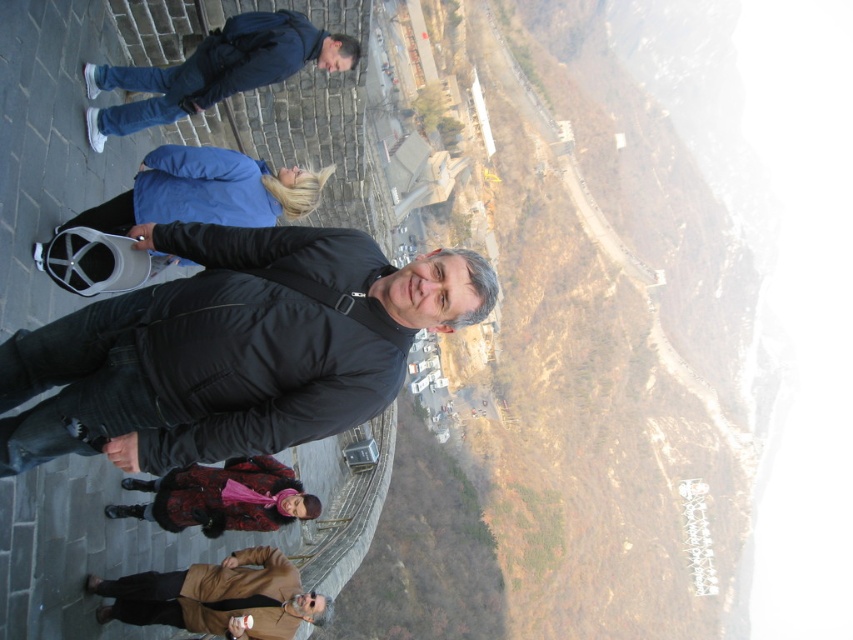
Question: Observing the image, what is the correct spatial positioning of black matte jacket at center in reference to velvet-like red coat at center?

Choices:
 (A) right
 (B) left

Answer: (A)

Question: Which point appears farthest from the camera in this image?

Choices:
 (A) (119, 618)
 (B) (155, 81)
 (C) (236, 484)

Answer: (C)

Question: Is matte blue jacket at center smaller than brown leather jacket at lower center?

Choices:
 (A) no
 (B) yes

Answer: (A)

Question: Which object appears closest to the camera in this image?

Choices:
 (A) black matte jacket at center
 (B) matte blue jacket at center

Answer: (A)

Question: From the image, what is the correct spatial relationship of dark blue jacket at upper left in relation to brown leather jacket at lower center?

Choices:
 (A) left
 (B) right

Answer: (A)

Question: Which point is closer to the camera?

Choices:
 (A) (18, 438)
 (B) (169, 618)

Answer: (A)